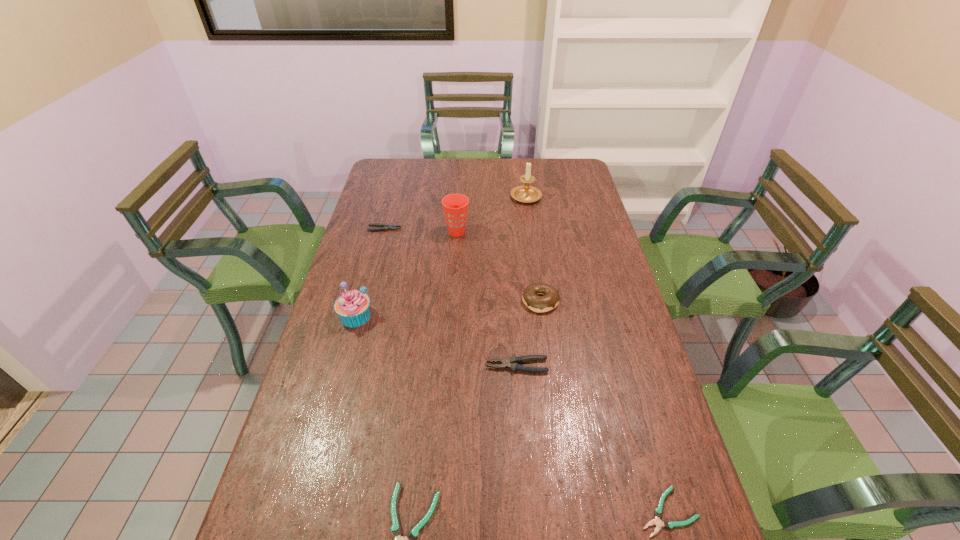
You are a GUI agent. You are given a task and a screenshot of the screen. Output one action in this format:
    pyautogui.click(x=<x>, y=<y>)
    Task: Click on the free space at the far left corner of the desktop
    
    Given the screenshot: What is the action you would take?
    pyautogui.click(x=393, y=180)

Find the location of a particular element. This screenshot has height=540, width=960. unoccupied position between the leftmost pliers and the blue muffin is located at coordinates (370, 272).

At what (x,y) coordinates should I click in order to perform the action: click on free space between the bigger gray pliers and the left gray pliers. Please return your answer as a coordinate pair (x, y). The image size is (960, 540). Looking at the image, I should click on (451, 298).

I want to click on blank region between the farther gray pliers and the blue muffin, so click(x=370, y=272).

Where is `unoccupied position between the beige candle holder and the smaller teal pliers`? unoccupied position between the beige candle holder and the smaller teal pliers is located at coordinates (596, 354).

This screenshot has height=540, width=960. Identify the location of vacant region between the rightmost object and the beige candle holder. (596, 354).

You are a GUI agent. You are given a task and a screenshot of the screen. Output one action in this format:
    pyautogui.click(x=<x>, y=<y>)
    Task: Click on the free space that is in between the brown doughnut and the third pliers from left to right
    This screenshot has width=960, height=540.
    Given the screenshot: What is the action you would take?
    pyautogui.click(x=529, y=333)

The image size is (960, 540). Find the location of `the sixth closest object to the third pliers from right to left`. the sixth closest object to the third pliers from right to left is located at coordinates (385, 227).

Identify which object is the fifth closest to the doughnut. Please provide its 2D coordinates. Your answer should be formatted as a tuple, i.e. [(x, y)], where the tuple contains the x and y coordinates of a point satisfying the conditions above.

[(668, 524)]

I want to click on pliers that is the second nearest to the rightmost pliers, so click(396, 530).